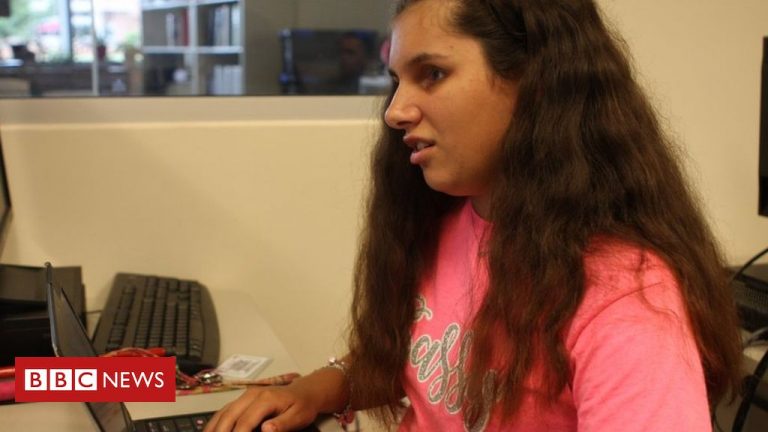
Image resolution: width=768 pixels, height=432 pixels. What are the coordinates of `computer screen` in the screenshot? It's located at (759, 187), (7, 200).